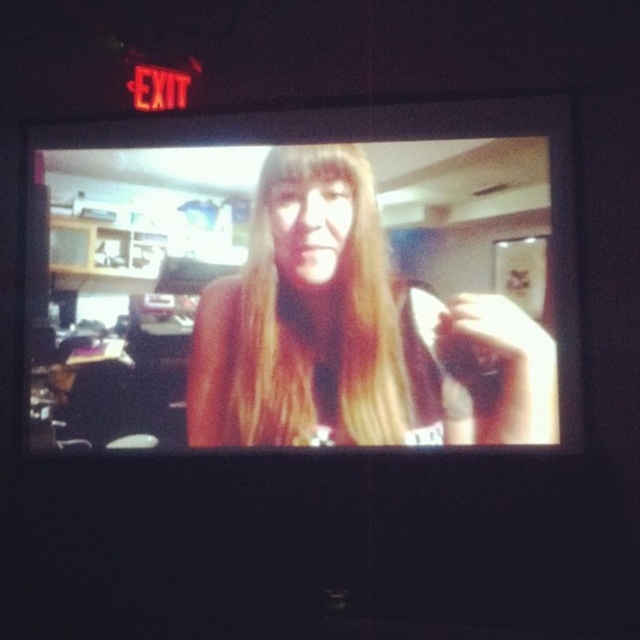
You are a security camera monitoring the room. You notice the smooth skin face at center and the blonde silky hair at center. Which one is closer to you?

The smooth skin face at center is closer to the viewer than the blonde silky hair at center.